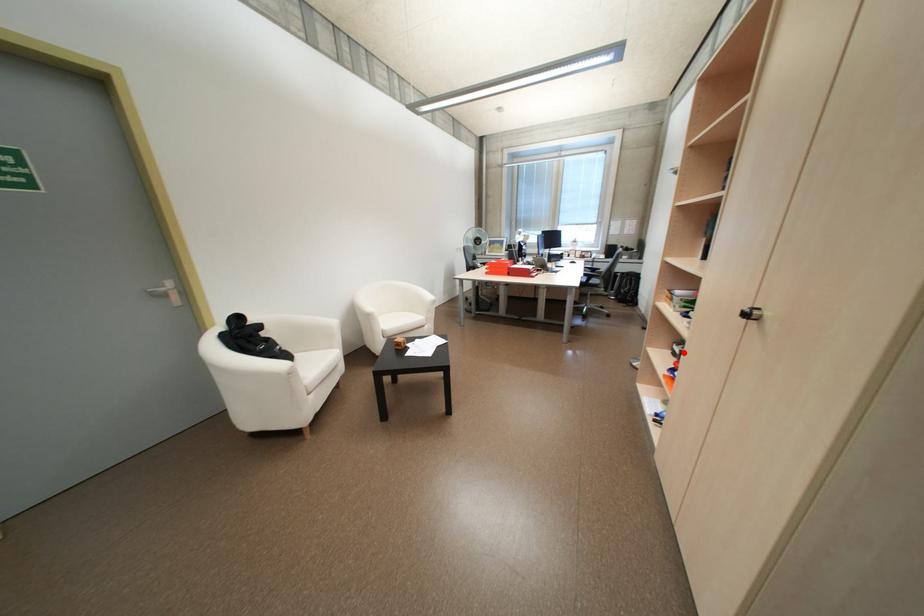
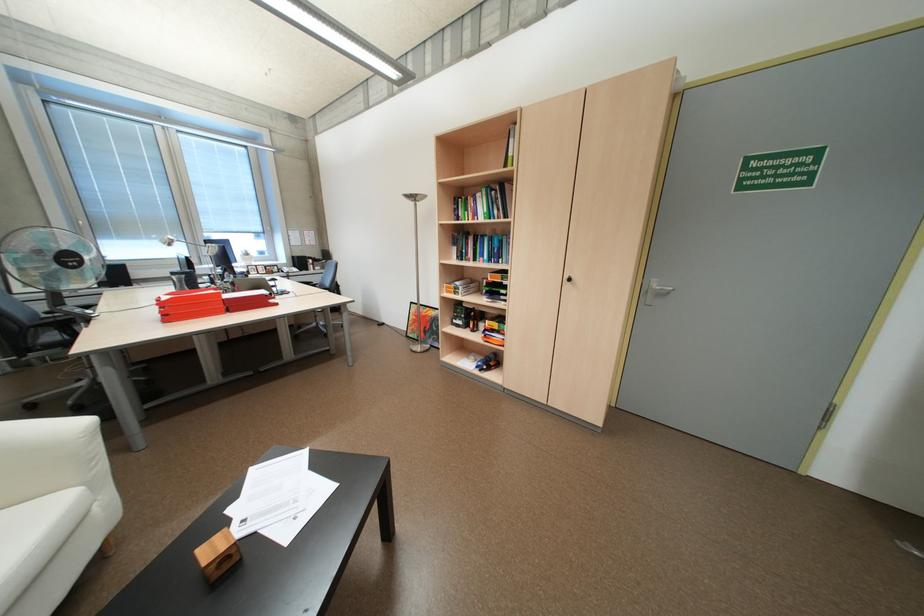
Where in the second image is the point corresponding to the highlighted location from the first image?

(468, 325)